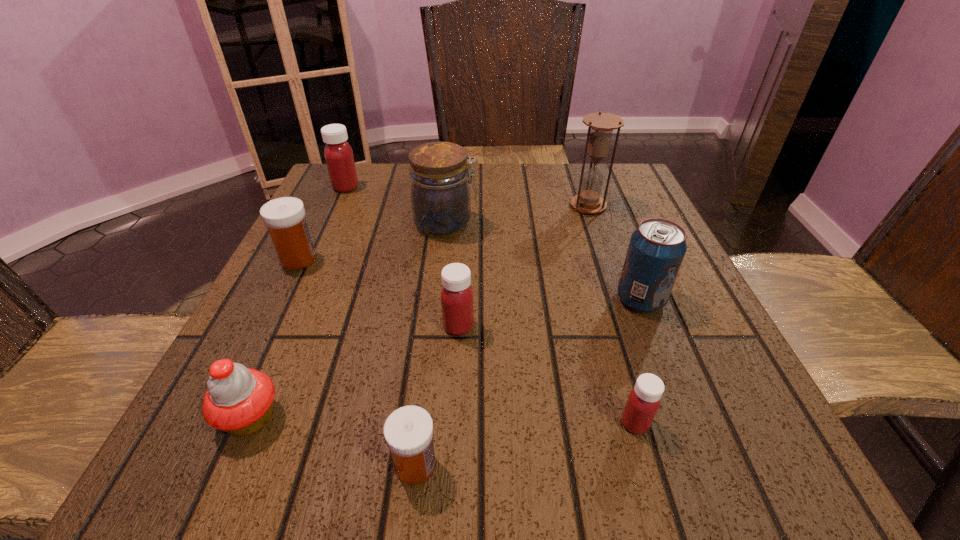
Identify the location of cupcake. (239, 400).

Locate an element on the screen. the rightmost medicine is located at coordinates (643, 402).

I want to click on the smallest red medicine, so click(643, 402).

At what (x,y) coordinates should I click in order to perform the action: click on the nearer white medicine. Please return your answer as a coordinate pair (x, y). This screenshot has height=540, width=960. Looking at the image, I should click on (408, 431).

I want to click on the nearest medicine, so click(x=408, y=431).

Where is `free space located on the right of the hourglass`? This screenshot has width=960, height=540. free space located on the right of the hourglass is located at coordinates (640, 206).

Locate an element on the screen. The width and height of the screenshot is (960, 540). vacant space located on the lid of the jar is located at coordinates (628, 225).

You are a GUI agent. You are given a task and a screenshot of the screen. Output one action in this format:
    pyautogui.click(x=<x>, y=<y>)
    Task: Click on the vacant space located 0.370m on the right of the farthest object
    This screenshot has width=960, height=540.
    Given the screenshot: What is the action you would take?
    pyautogui.click(x=509, y=187)

Locate an element on the screen. The image size is (960, 540). vacant area located 0.080m on the back of the pop soda is located at coordinates (624, 257).

At what (x,y) coordinates should I click in order to perform the action: click on vacant space located 0.250m on the front of the bigger white medicine. Please return your answer as a coordinate pair (x, y). Looking at the image, I should click on (239, 379).